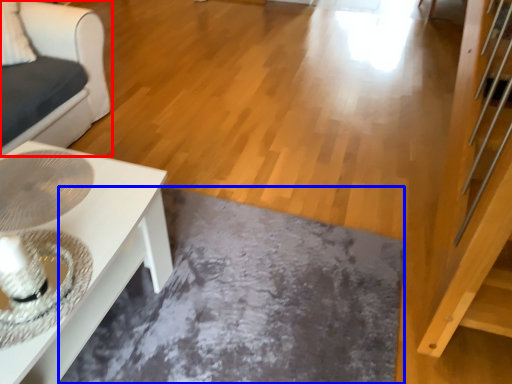
Question: Which object appears closest to the camera in this image, furniture (highlighted by a red box) or slate (highlighted by a blue box)?

Choices:
 (A) furniture
 (B) slate

Answer: (B)